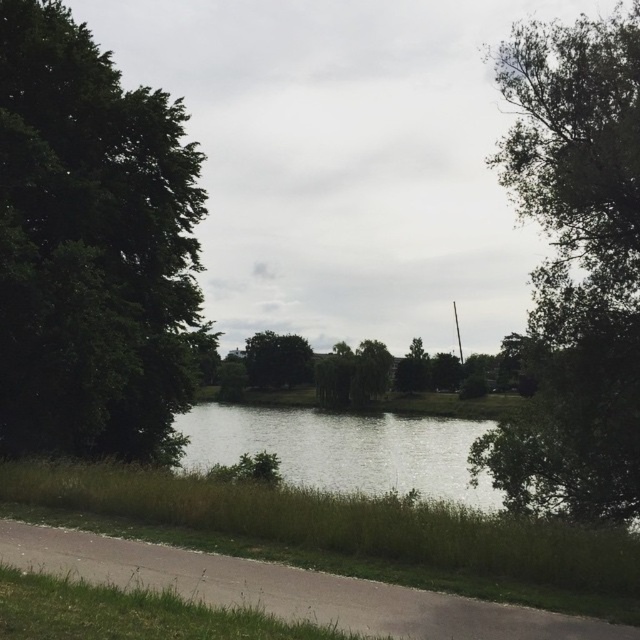
Between gray asphalt path at lower center and green grassy river at center, which one has more height?

With more height is green grassy river at center.

Who is positioned more to the right, gray asphalt path at lower center or green grassy river at center?

green grassy river at center is more to the right.

Which is in front, point (385, 612) or point (365, 444)?

Point (385, 612) is more forward.

Find the location of `gray asphalt path at lower center`. gray asphalt path at lower center is located at coordinates (289, 588).

Is point (54, 316) less distant than point (234, 449)?

Yes, it is.

Which is in front, point (166, 440) or point (376, 435)?

Positioned in front is point (166, 440).

Is point (88, 96) positioned after point (397, 488)?

No, (88, 96) is in front of (397, 488).

Where is `green leafy tree at left`? This screenshot has width=640, height=640. green leafy tree at left is located at coordinates (92, 246).

Does green leafy tree at right appear over gray asphalt path at lower center?

Correct, green leafy tree at right is located above gray asphalt path at lower center.

Does green leafy tree at right have a smaller size compared to gray asphalt path at lower center?

No.

What do you see at coordinates (579, 266) in the screenshot?
I see `green leafy tree at right` at bounding box center [579, 266].

The image size is (640, 640). In order to click on green leafy tree at right in this screenshot , I will do `click(579, 266)`.